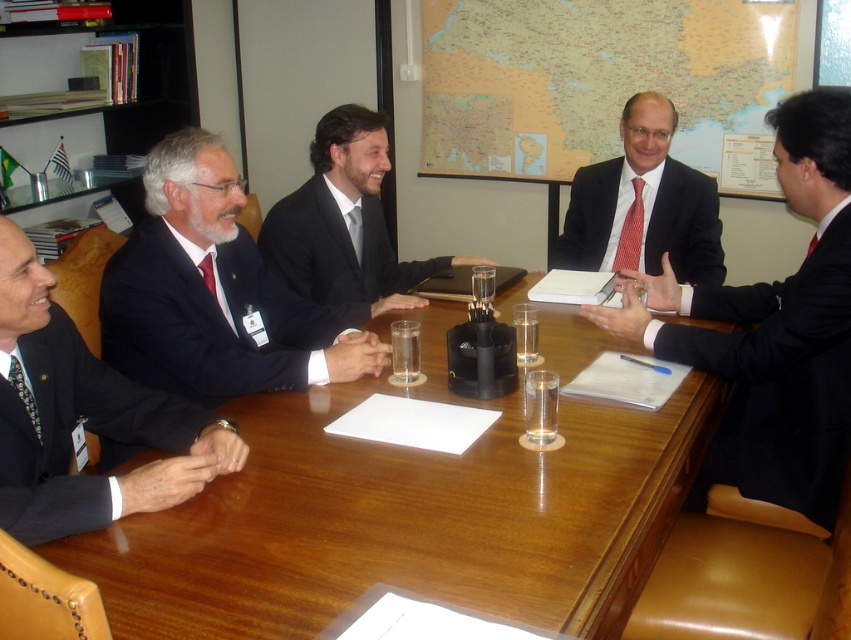
You are a service robot with a width of 1 meter. You need to move between the matte black suit at center and the dark blue suit at left to deliver a document. Can you fit through the space between them?

The distance between the matte black suit at center and the dark blue suit at left is 1.23 meters. Since the robot is 1 meter wide, it can fit through the space as the distance is wider than the robot.

You are standing at the point labeled point (10,284) in the image. If you want to walk to the point labeled point (317,342), which direction should you move relative to your current position?

To reach point (317,342) from point (10,284), you should move forward since the destination is behind the starting point.